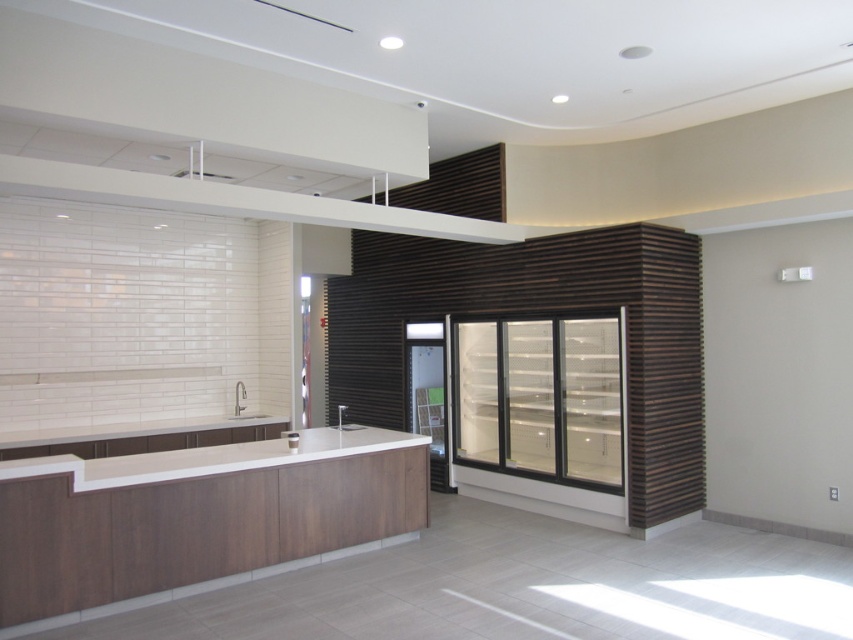
You are a customer entering the establishment and want to grab a drink from the clear glass refrigerator at center and wash your hands at the matte white sink at center. Which object will you encounter first as you approach the counter?

You will encounter the clear glass refrigerator at center first because it is closer to the viewer than the matte white sink at center.

You are a barista working in this space and need to place a coffee cup on the counter. The cup requires 6 inches of space to avoid tipping over. Can you safely place the cup on either the white matte countertop at center or the white glossy countertop at center?

The white matte countertop at center and white glossy countertop at center are 8.09 inches apart from each other. Since the required space is 6 inches, the cup can be safely placed on either countertop as the distance between them is sufficient.

You are a barista working in the described space and need to place a large coffee machine on the countertop. Which countertop, the white matte countertop at center or the white glossy countertop at center, has enough space for the machine?

The white matte countertop at center is larger in size than the white glossy countertop at center, so it has enough space for the large coffee machine.